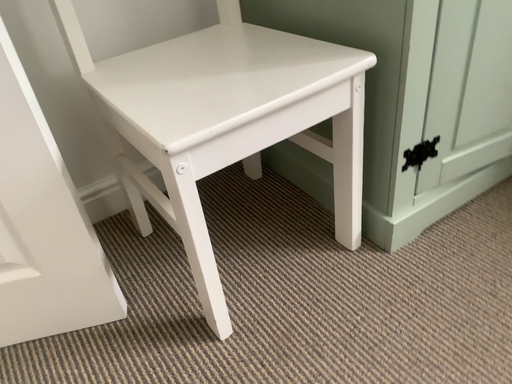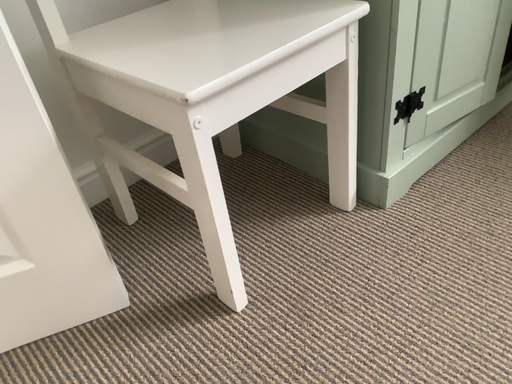
Question: Which way did the camera rotate in the video?

Choices:
 (A) rotated right
 (B) rotated left

Answer: (A)